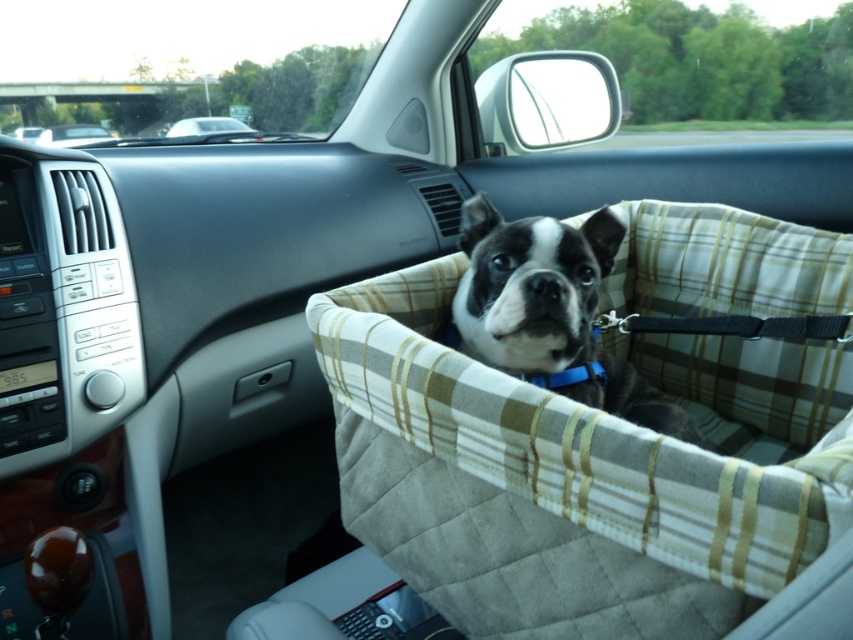
You are a car designer evaluating two models displayed in a showroom. You see the matte black car at upper left and the white plastic car at upper center. Which car has a greater height measurement?

The matte black car at upper left is taller than the white plastic car at upper center according to the description.